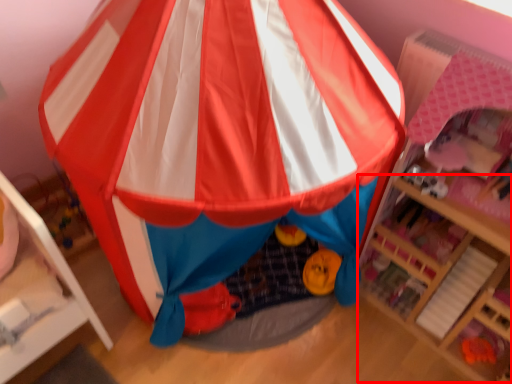
Question: From the image, what is the correct spatial relationship of shelf (annotated by the red box) in relation to tent?

Choices:
 (A) right
 (B) left

Answer: (A)